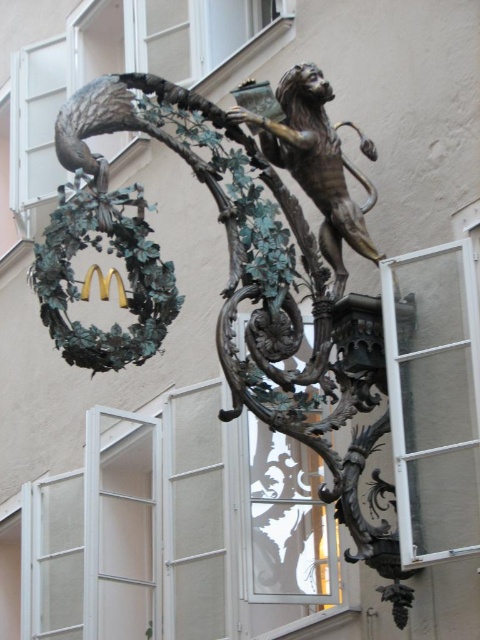
What do you see at coordinates (223, 291) in the screenshot?
I see `bronze sculpture at center` at bounding box center [223, 291].

Can you confirm if bronze sculpture at center is smaller than clear glass window at right?

Actually, bronze sculpture at center might be larger than clear glass window at right.

Which is behind, point (311, 289) or point (471, 484)?

The point (311, 289) is behind.

Identify the location of bronze sculpture at center. (223, 291).